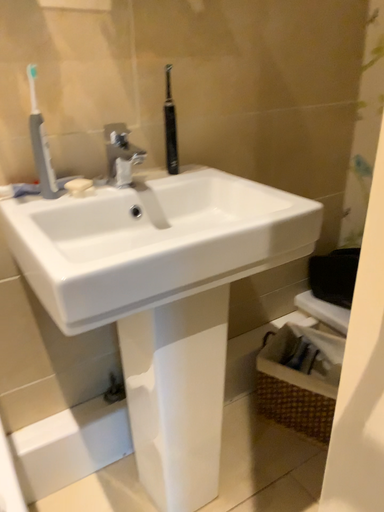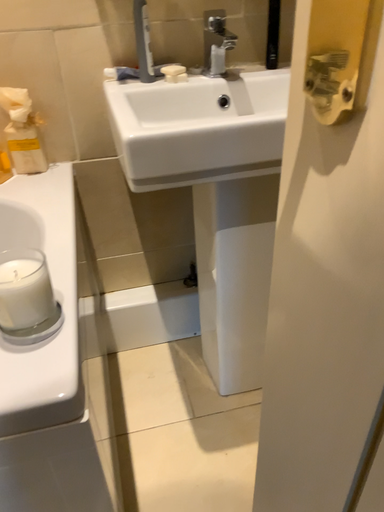
Question: Which way did the camera rotate in the video?

Choices:
 (A) rotated right
 (B) rotated left

Answer: (B)